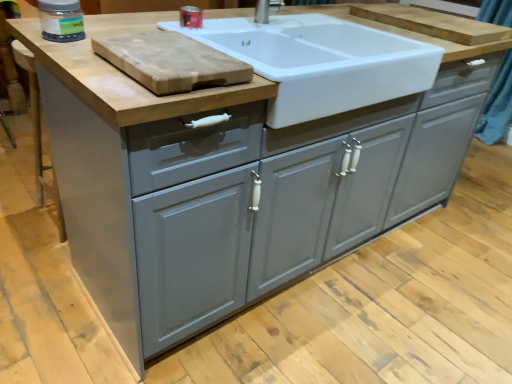
What do you see at coordinates (124, 74) in the screenshot?
I see `white glossy sink at upper center` at bounding box center [124, 74].

What do you see at coordinates (61, 20) in the screenshot? The image size is (512, 384). I see `transparent plastic jar at upper left, which is the 1th appliance in front-to-back order` at bounding box center [61, 20].

Locate an element on the screen. Image resolution: width=512 pixels, height=384 pixels. natural wood cutting board at upper left, the 2th cutting board from the back is located at coordinates (170, 61).

Locate an element on the screen. The height and width of the screenshot is (384, 512). wooden cutting board at upper center, which ranks as the 2th cutting board in bottom-to-top order is located at coordinates (433, 23).

From the picture: What's the angular difference between matte plastic container at upper center, the second appliance viewed from the left, and transparent plastic jar at upper left, which is counted as the first appliance, starting from the left,'s facing directions?

0.707 degrees.

How far apart are matte plastic container at upper center, the 1th appliance in the right-to-left sequence, and transparent plastic jar at upper left, the 2th appliance viewed from the right?

matte plastic container at upper center, the 1th appliance in the right-to-left sequence, and transparent plastic jar at upper left, the 2th appliance viewed from the right, are 37.76 centimeters apart from each other.

Identify the location of appliance below the matte plastic container at upper center, the 1th appliance in the right-to-left sequence (from the image's perspective). The width and height of the screenshot is (512, 384). (61, 20).

Is matte plastic container at upper center, arranged as the 1th appliance when viewed from the back, closer to camera compared to transparent plastic jar at upper left, which is counted as the 2th appliance, starting from the back?

No, the depth of matte plastic container at upper center, arranged as the 1th appliance when viewed from the back, is greater than that of transparent plastic jar at upper left, which is counted as the 2th appliance, starting from the back.

Does white glossy sink at upper center appear on the left side of matte plastic container at upper center, the 1th appliance in the right-to-left sequence?

In fact, white glossy sink at upper center is to the right of matte plastic container at upper center, the 1th appliance in the right-to-left sequence.

From a real-world perspective, is white glossy sink at upper center positioned under matte plastic container at upper center, the second appliance positioned from the front, based on gravity?

Yes, from a real-world perspective, white glossy sink at upper center is below matte plastic container at upper center, the second appliance positioned from the front.

In terms of width, does white glossy sink at upper center look wider or thinner when compared to matte plastic container at upper center, the second appliance positioned from the front?

Considering their sizes, white glossy sink at upper center looks broader than matte plastic container at upper center, the second appliance positioned from the front.

Does white glossy sink at upper center have a larger size compared to matte plastic container at upper center, arranged as the 1th appliance when viewed from the back?

Yes.

Based on their positions, is wooden cutting board at upper center, the 1th cutting board positioned from the right, located to the left or right of white glossy sink at upper center?

→ wooden cutting board at upper center, the 1th cutting board positioned from the right, is to the right of white glossy sink at upper center.

Relative to white glossy sink at upper center, is wooden cutting board at upper center, the 2th cutting board positioned from the left, in front or behind?

wooden cutting board at upper center, the 2th cutting board positioned from the left, is positioned farther from the viewer than white glossy sink at upper center.

Could you tell me if wooden cutting board at upper center, the 1th cutting board positioned from the top, is facing white glossy sink at upper center?

No, wooden cutting board at upper center, the 1th cutting board positioned from the top, is not aimed at white glossy sink at upper center.

From the image's perspective, is wooden cutting board at upper center, the 2th cutting board positioned from the left, located above or below white glossy sink at upper center?

Clearly, from the image's perspective, wooden cutting board at upper center, the 2th cutting board positioned from the left, is above white glossy sink at upper center.

Considering the positions of point (146, 106) and point (147, 50), is point (146, 106) closer or farther from the camera than point (147, 50)?

Point (146, 106) is positioned closer to the camera compared to point (147, 50).

Is white glossy sink at upper center positioned beyond the bounds of natural wood cutting board at upper left, the 2th cutting board from the right?

Yes.

Is white glossy sink at upper center with natural wood cutting board at upper left, which ranks as the 1th cutting board in front-to-back order?

No, white glossy sink at upper center is not beside natural wood cutting board at upper left, which ranks as the 1th cutting board in front-to-back order.

How different are the orientations of white glossy sink at upper center and natural wood cutting board at upper left, which ranks as the 1th cutting board in front-to-back order, in degrees?

There is a 180-degree angle between the facing directions of white glossy sink at upper center and natural wood cutting board at upper left, which ranks as the 1th cutting board in front-to-back order.

From the image's perspective, is wooden cutting board at upper center, the 1th cutting board positioned from the right, located above or below matte plastic container at upper center, the second appliance viewed from the left?

wooden cutting board at upper center, the 1th cutting board positioned from the right, is above matte plastic container at upper center, the second appliance viewed from the left.

In terms of size, does wooden cutting board at upper center, the 1th cutting board positioned from the right, appear bigger or smaller than matte plastic container at upper center, the second appliance viewed from the left?

In the image, wooden cutting board at upper center, the 1th cutting board positioned from the right, appears to be larger than matte plastic container at upper center, the second appliance viewed from the left.

Considering the relative positions of wooden cutting board at upper center, the 1th cutting board when ordered from back to front, and matte plastic container at upper center, arranged as the 1th appliance when viewed from the back, in the image provided, is wooden cutting board at upper center, the 1th cutting board when ordered from back to front, to the left or to the right of matte plastic container at upper center, arranged as the 1th appliance when viewed from the back,?

In the image, wooden cutting board at upper center, the 1th cutting board when ordered from back to front, appears on the right side of matte plastic container at upper center, arranged as the 1th appliance when viewed from the back.

How different are the orientations of wooden cutting board at upper center, the 1th cutting board positioned from the right, and matte plastic container at upper center, arranged as the 1th appliance when viewed from the back, in degrees?

They differ by 0.707 degrees in their facing directions.

Could you measure the distance between transparent plastic jar at upper left, the 2th appliance viewed from the right, and matte plastic container at upper center, the second appliance viewed from the left?

14.87 inches.

Considering the positions of point (55, 16) and point (192, 27), is point (55, 16) closer or farther from the camera than point (192, 27)?

Point (55, 16) is closer to the camera than point (192, 27).

At what (x,y) coordinates should I click in order to perform the action: click on appliance behind the transparent plastic jar at upper left, which is the 1th appliance in front-to-back order. Please return your answer as a coordinate pair (x, y). Looking at the image, I should click on (191, 17).

Consider the image. Is transparent plastic jar at upper left, the 2th appliance viewed from the right, to the left of matte plastic container at upper center, the second appliance viewed from the left, from the viewer's perspective?

Correct, you'll find transparent plastic jar at upper left, the 2th appliance viewed from the right, to the left of matte plastic container at upper center, the second appliance viewed from the left.

Does natural wood cutting board at upper left, the 2th cutting board from the back, have a lesser width compared to transparent plastic jar at upper left, which is counted as the 2th appliance, starting from the back?

No.

Considering the relative sizes of natural wood cutting board at upper left, the 2th cutting board from the right, and transparent plastic jar at upper left, which is the 1th appliance in front-to-back order, in the image provided, is natural wood cutting board at upper left, the 2th cutting board from the right, bigger than transparent plastic jar at upper left, which is the 1th appliance in front-to-back order,?

Yes, natural wood cutting board at upper left, the 2th cutting board from the right, is bigger than transparent plastic jar at upper left, which is the 1th appliance in front-to-back order.

Looking at this image, does natural wood cutting board at upper left, which ranks as the 1th cutting board in front-to-back order, appear on the left side of transparent plastic jar at upper left, which is the 1th appliance in front-to-back order?

No.

Find the location of `appliance above the transparent plastic jar at upper left, the 2th appliance viewed from the right (from the image's perspective)`. appliance above the transparent plastic jar at upper left, the 2th appliance viewed from the right (from the image's perspective) is located at coordinates (191, 17).

At what (x,y) coordinates should I click in order to perform the action: click on countertop that is below the matte plastic container at upper center, arranged as the 1th appliance when viewed from the back (from the image's perspective). Please return your answer as a coordinate pair (x, y). Looking at the image, I should click on (124, 74).

Looking at the image, which one is located further to natural wood cutting board at upper left, the second cutting board positioned from the top, white glossy sink at upper center or matte plastic container at upper center, the second appliance viewed from the left?

Based on the image, matte plastic container at upper center, the second appliance viewed from the left, appears to be further to natural wood cutting board at upper left, the second cutting board positioned from the top.

From the image, which object appears to be farther from wooden cutting board at upper center, the 2th cutting board positioned from the left, transparent plastic jar at upper left, which is counted as the first appliance, starting from the left, or natural wood cutting board at upper left, the 2th cutting board from the right?

transparent plastic jar at upper left, which is counted as the first appliance, starting from the left.

Looking at the image, which one is located further to transparent plastic jar at upper left, which is counted as the first appliance, starting from the left, wooden cutting board at upper center, the 1th cutting board positioned from the right, or white glossy sink at upper center?

wooden cutting board at upper center, the 1th cutting board positioned from the right.

When comparing their distances from wooden cutting board at upper center, the 2th cutting board positioned from the left, does natural wood cutting board at upper left, which is the 1th cutting board from left to right, or transparent plastic jar at upper left, which is counted as the first appliance, starting from the left, seem further?

transparent plastic jar at upper left, which is counted as the first appliance, starting from the left, is positioned further to the anchor wooden cutting board at upper center, the 2th cutting board positioned from the left.

Estimate the real-world distances between objects in this image. Which object is closer to natural wood cutting board at upper left, which ranks as the 1th cutting board in front-to-back order, wooden cutting board at upper center, which ranks as the 2th cutting board in bottom-to-top order, or white glossy sink at upper center?

white glossy sink at upper center.

Consider the image. Estimate the real-world distances between objects in this image. Which object is closer to white glossy sink at upper center, transparent plastic jar at upper left, which is counted as the first appliance, starting from the left, or wooden cutting board at upper center, the 1th cutting board when ordered from back to front?

transparent plastic jar at upper left, which is counted as the first appliance, starting from the left, lies closer to white glossy sink at upper center than the other object.

Which object lies further to the anchor point transparent plastic jar at upper left, which is counted as the 2th appliance, starting from the back, natural wood cutting board at upper left, the 2th cutting board from the right, or wooden cutting board at upper center, the 2th cutting board positioned from the left?

wooden cutting board at upper center, the 2th cutting board positioned from the left.

Looking at the image, which one is located closer to transparent plastic jar at upper left, which is counted as the 2th appliance, starting from the back, white glossy sink at upper center or matte plastic container at upper center, the 1th appliance in the right-to-left sequence?

Among the two, white glossy sink at upper center is located nearer to transparent plastic jar at upper left, which is counted as the 2th appliance, starting from the back.

In order to click on countertop between natural wood cutting board at upper left, the 2th cutting board from the back, and matte plastic container at upper center, the second appliance positioned from the front, along the z-axis in this screenshot , I will do `click(124, 74)`.

Where is `appliance between natural wood cutting board at upper left, the 2th cutting board from the right, and wooden cutting board at upper center, marked as the 2th cutting board in a front-to-back arrangement`? appliance between natural wood cutting board at upper left, the 2th cutting board from the right, and wooden cutting board at upper center, marked as the 2th cutting board in a front-to-back arrangement is located at coordinates (191, 17).

Identify the location of countertop located between natural wood cutting board at upper left, which is the 1th cutting board from left to right, and wooden cutting board at upper center, the 1th cutting board positioned from the right, in the left-right direction. (124, 74).

Image resolution: width=512 pixels, height=384 pixels. I want to click on cutting board between transparent plastic jar at upper left, which is the 1th appliance in front-to-back order, and white glossy sink at upper center, so pyautogui.click(x=170, y=61).